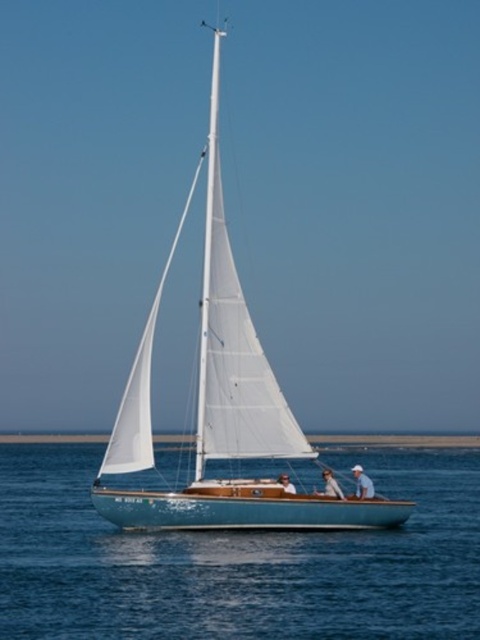
Question: Which object is closer to the camera taking this photo?

Choices:
 (A) light blue fabric sailboat at center
 (B) teal polished wood sailboat at center
 (C) white fabric hat at lower center
 (D) blue smooth water at center

Answer: (D)

Question: Which of the following is the closest to the observer?

Choices:
 (A) teal polished wood sailboat at center
 (B) white fabric hat at lower center
 (C) light brown wooden sailboat at center
 (D) blue smooth water at center

Answer: (D)

Question: Is teal polished wood sailboat at center behind light blue fabric sailboat at center?

Choices:
 (A) no
 (B) yes

Answer: (A)

Question: Estimate the real-world distances between objects in this image. Which object is closer to the light blue fabric sailboat at center?

Choices:
 (A) teal polished wood sailboat at center
 (B) blue smooth water at center
 (C) white fabric hat at lower center
 (D) light brown wooden sailboat at center

Answer: (D)

Question: Can you confirm if blue smooth water at center is thinner than light brown wooden sailboat at center?

Choices:
 (A) yes
 (B) no

Answer: (B)

Question: Observing the image, what is the correct spatial positioning of blue smooth water at center in reference to teal polished wood sailboat at center?

Choices:
 (A) right
 (B) left

Answer: (A)